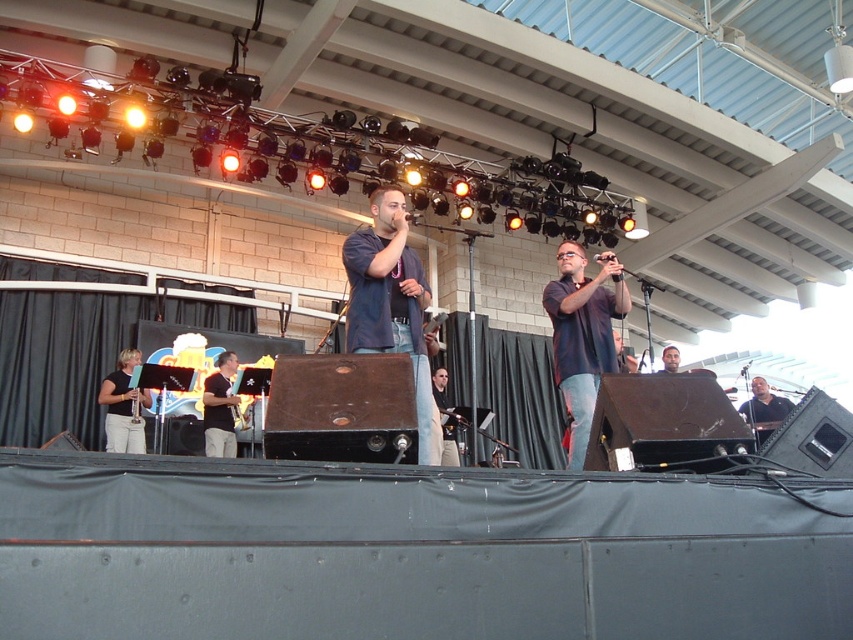
You are a photographer trying to capture a closeup shot of the smooth skin face at center without the light brown wood saxophone at center blocking the view. Given their sizes, is this possible?

The light brown wood saxophone at center is wider than the smooth skin face at center, so it may block part of the face if positioned directly in front. Adjust the angle to ensure the saxophone doesn

Consider the image. You are a stagehand who needs to move a 3.5 meter long equipment from the matte black clarinet at lower left to the dark blue jeans at center. Can you move it without bending the equipment?

The distance between the matte black clarinet at lower left and the dark blue jeans at center is 4.32 meters, so yes, the 3.5 meter long equipment can be moved without bending since it is shorter than the available space.

You are a stagehand adjusting the lighting for the performance. You notice the matte black shirt at center and the black plastic microphone at center. Which object is positioned higher from the stage floor?

The black plastic microphone at center is higher than the matte black shirt at center because the matte black shirt at center is below the microphone.